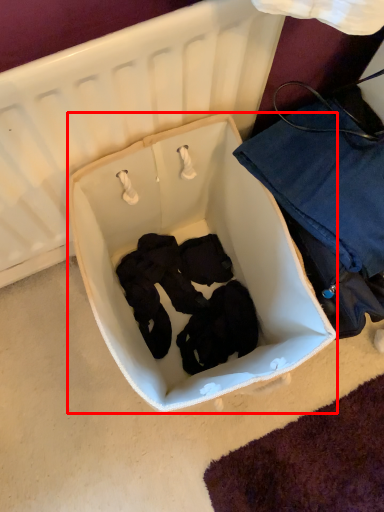
Question: Considering the relative positions of infant bed (annotated by the red box) and clothing in the image provided, where is infant bed (annotated by the red box) located with respect to the staircase?

Choices:
 (A) right
 (B) left

Answer: (B)